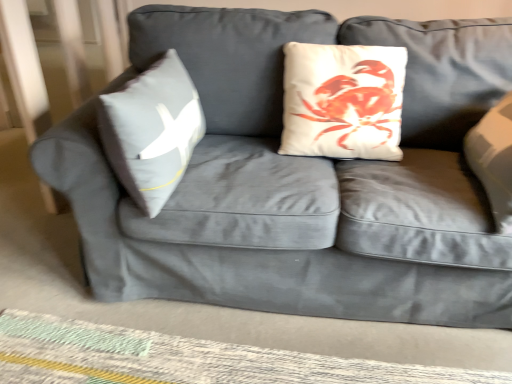
Describe the element at coordinates (183, 359) in the screenshot. I see `woven fabric mat at lower center` at that location.

I want to click on woven fabric mat at lower center, so click(183, 359).

Describe the element at coordinates (152, 131) in the screenshot. Image resolution: width=512 pixels, height=384 pixels. I see `gray fabric pillow at left` at that location.

Identify the location of gray fabric pillow at left. (152, 131).

Identify the location of woven fabric mat at lower center. (183, 359).

Is woven fabric mat at lower center to the left of gray fabric pillow at left from the viewer's perspective?

Incorrect, woven fabric mat at lower center is not on the left side of gray fabric pillow at left.

Does woven fabric mat at lower center lie behind gray fabric pillow at left?

Yes.

Is point (12, 316) positioned after point (131, 100)?

Yes, point (12, 316) is behind point (131, 100).

From the image's perspective, between woven fabric mat at lower center and gray fabric pillow at left, which one is located above?

From the image's view, gray fabric pillow at left is above.

Looking at this image, from a real-world perspective, is woven fabric mat at lower center physically below gray fabric pillow at left?

Yes.

Which of these two, woven fabric mat at lower center or gray fabric pillow at left, is thinner?

With smaller width is gray fabric pillow at left.

Does woven fabric mat at lower center have a greater height compared to gray fabric pillow at left?

No.

Considering the sizes of objects woven fabric mat at lower center and gray fabric pillow at left in the image provided, who is bigger, woven fabric mat at lower center or gray fabric pillow at left?

gray fabric pillow at left is bigger.

Is woven fabric mat at lower center outside of gray fabric pillow at left?

Yes.

Is woven fabric mat at lower center far from gray fabric pillow at left?

No, woven fabric mat at lower center is not far away from gray fabric pillow at left.

Is woven fabric mat at lower center turned away from gray fabric pillow at left?

No.

At what (x,y) coordinates should I click in order to perform the action: click on pillow above the woven fabric mat at lower center (from the image's perspective). Please return your answer as a coordinate pair (x, y). This screenshot has width=512, height=384. Looking at the image, I should click on (152, 131).

Is gray fabric pillow at left at the right side of woven fabric mat at lower center?

No, gray fabric pillow at left is not to the right of woven fabric mat at lower center.

Is gray fabric pillow at left behind woven fabric mat at lower center?

No, gray fabric pillow at left is closer to the viewer.

Is point (190, 79) positioned in front of point (153, 356)?

No, it is behind (153, 356).

From the image's perspective, which is below, gray fabric pillow at left or woven fabric mat at lower center?

From the image's view, woven fabric mat at lower center is below.

From a real-world perspective, between gray fabric pillow at left and woven fabric mat at lower center, who is vertically lower?

From a 3D spatial view, woven fabric mat at lower center is below.

Which object is thinner, gray fabric pillow at left or woven fabric mat at lower center?

With smaller width is gray fabric pillow at left.

Can you confirm if gray fabric pillow at left is taller than woven fabric mat at lower center?

Yes, gray fabric pillow at left is taller than woven fabric mat at lower center.

Is gray fabric pillow at left bigger or smaller than woven fabric mat at lower center?

Clearly, gray fabric pillow at left is larger in size than woven fabric mat at lower center.

Is gray fabric pillow at left completely or partially outside of woven fabric mat at lower center?

gray fabric pillow at left is positioned outside woven fabric mat at lower center.

Is gray fabric pillow at left not close to woven fabric mat at lower center?

No, gray fabric pillow at left is not far from woven fabric mat at lower center.

Is gray fabric pillow at left facing towards woven fabric mat at lower center?

No, gray fabric pillow at left does not turn towards woven fabric mat at lower center.

Find the location of a particular element. The image size is (512, 384). pillow on the left of woven fabric mat at lower center is located at coordinates (152, 131).

At what (x,y) coordinates should I click in order to perform the action: click on mat below the gray fabric pillow at left (from a real-world perspective). Please return your answer as a coordinate pair (x, y). This screenshot has height=384, width=512. Looking at the image, I should click on (183, 359).

What are the coordinates of `pillow above the woven fabric mat at lower center (from a real-world perspective)` in the screenshot? It's located at (152, 131).